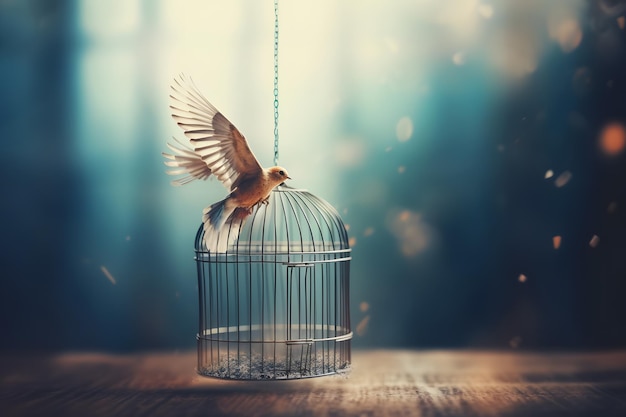
Find the location of `blurred table`. blurred table is located at coordinates (63, 387), (162, 374), (250, 409), (377, 369), (462, 401), (546, 369).